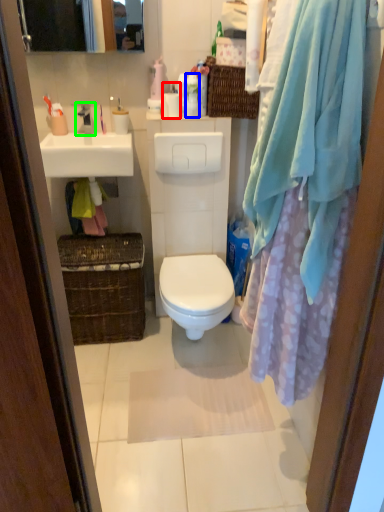
Question: Which object is the farthest from toiletry (highlighted by a red box)? Choose among these: toiletry (highlighted by a blue box) or tap (highlighted by a green box).

Choices:
 (A) toiletry
 (B) tap

Answer: (B)